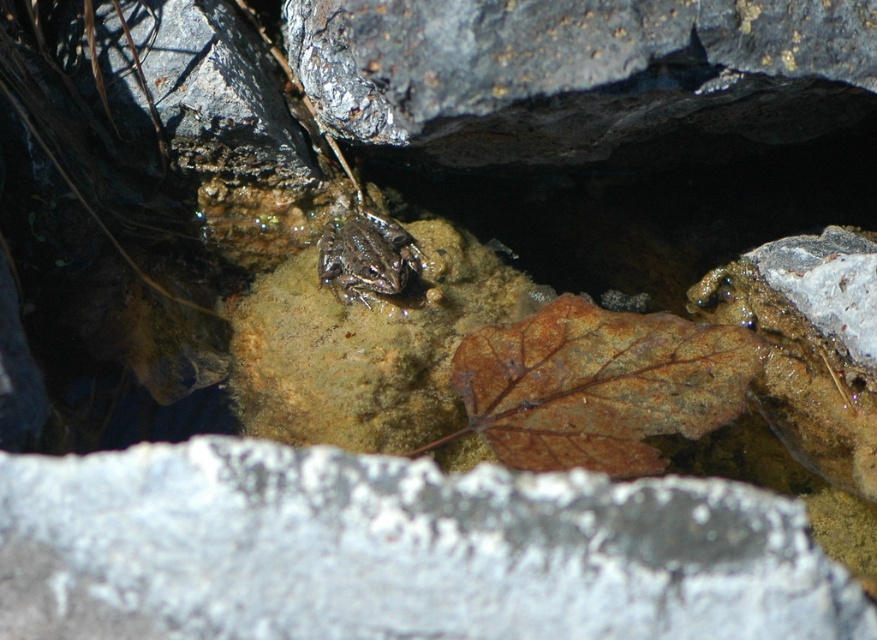
Question: Can you confirm if white rough stone at center is thinner than camouflage skin frog at center?

Choices:
 (A) yes
 (B) no

Answer: (B)

Question: Does rough gray rock at upper center have a larger size compared to brown matte leaf at center?

Choices:
 (A) no
 (B) yes

Answer: (B)

Question: Estimate the real-world distances between objects in this image. Which object is farther from the rough gray rock at upper center?

Choices:
 (A) camouflage skin frog at center
 (B) white rough stone at center
 (C) brown matte leaf at center

Answer: (B)

Question: Is white rough stone at center above camouflage skin frog at center?

Choices:
 (A) no
 (B) yes

Answer: (A)

Question: Which point is farther from the camera taking this photo?

Choices:
 (A) (538, 145)
 (B) (398, 252)
 (C) (59, 600)

Answer: (B)

Question: Which of the following is the farthest from the observer?

Choices:
 (A) (833, 100)
 (B) (421, 552)
 (C) (362, 256)
 (D) (533, 419)

Answer: (C)